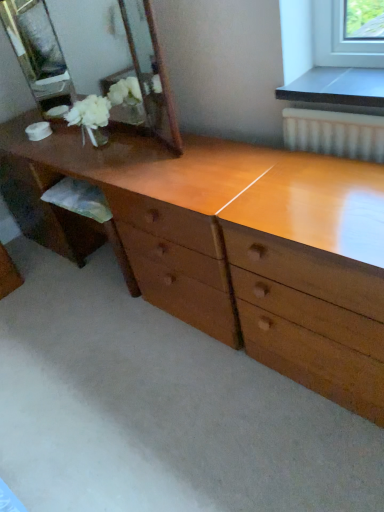
Image resolution: width=384 pixels, height=512 pixels. In order to click on free space in front of wooden mirror at upper left in this screenshot , I will do `click(154, 167)`.